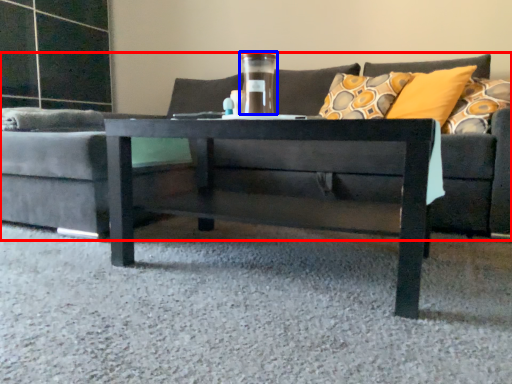
Question: Which point is further to the camera, studio couch (highlighted by a red box) or glass vase (highlighted by a blue box)?

Choices:
 (A) studio couch
 (B) glass vase

Answer: (B)